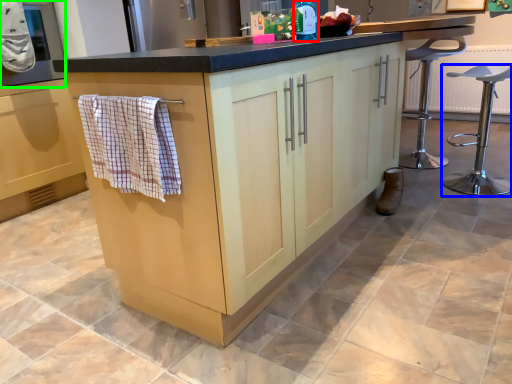
Question: Which is farther away from bottle (highlighted by a red box)? furniture (highlighted by a blue box) or oven (highlighted by a green box)?

Choices:
 (A) furniture
 (B) oven

Answer: (B)